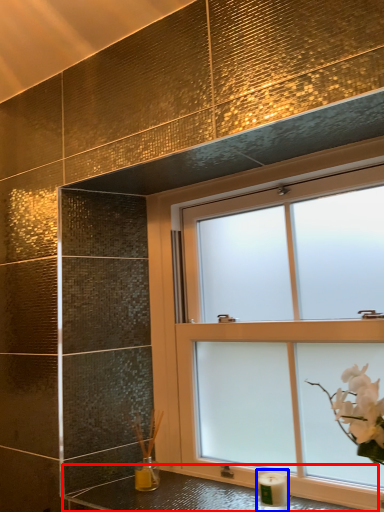
Question: Which of the following is the farthest to the observer, counter top (highlighted by a red box) or candle holder (highlighted by a blue box)?

Choices:
 (A) counter top
 (B) candle holder

Answer: (B)